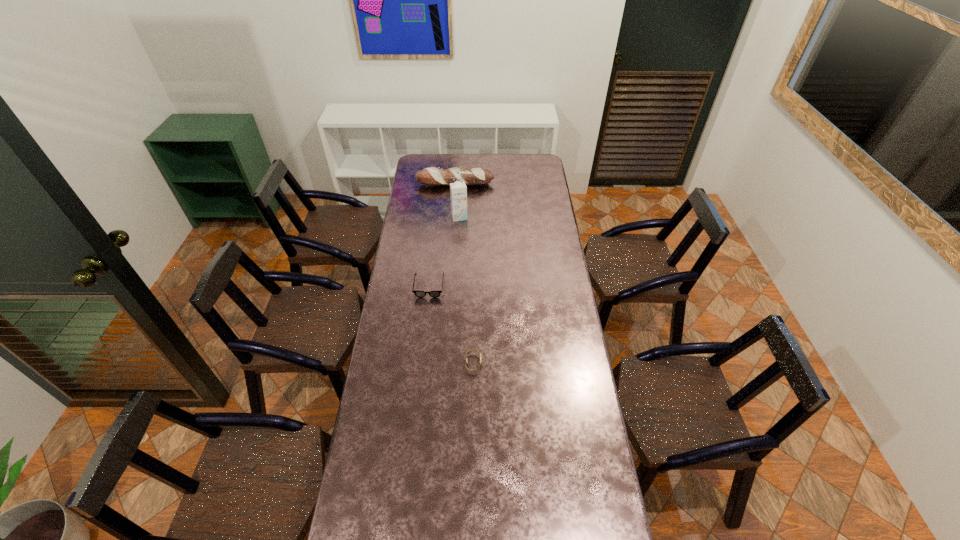
This screenshot has width=960, height=540. Identify the location of empty space between the spectacles and the baguet. (442, 235).

You are a GUI agent. You are given a task and a screenshot of the screen. Output one action in this format:
    pyautogui.click(x=<x>, y=<y>)
    Task: Click on the vacant area that lies between the spectacles and the shortest object
    The width and height of the screenshot is (960, 540).
    Given the screenshot: What is the action you would take?
    pyautogui.click(x=451, y=325)

At what (x,y) coordinates should I click in order to perform the action: click on vacant area that lies between the third farthest object and the baguet. Please return your answer as a coordinate pair (x, y). The width and height of the screenshot is (960, 540). Looking at the image, I should click on (442, 235).

Find the location of a particular element. This screenshot has width=960, height=540. free space between the spectacles and the second farthest object is located at coordinates (444, 252).

The height and width of the screenshot is (540, 960). I want to click on blank region between the baguet and the nearest object, so click(x=465, y=273).

This screenshot has width=960, height=540. Identify the location of object that is the second closest to the second nearest object. (458, 191).

Locate which object is the second closest to the baguet. Please provide its 2D coordinates. Your answer should be formatted as a tuple, i.e. [(x, y)], where the tuple contains the x and y coordinates of a point satisfying the conditions above.

[(420, 294)]